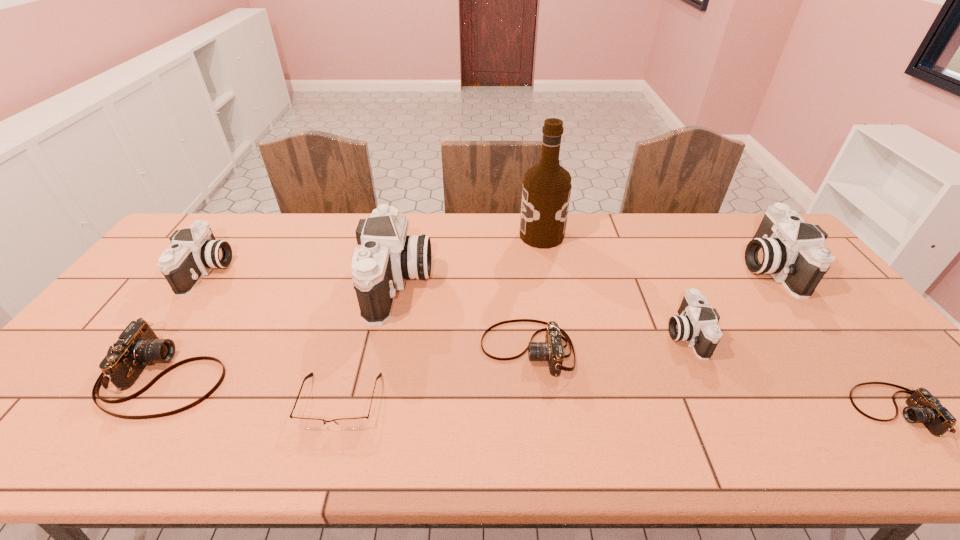
Identify the location of vacant space that's between the third black camera from right to left and the sixth tallest camera. tap(463, 316).

Find the location of `vacant area that lies between the tallest camera and the third tallest camera`. vacant area that lies between the tallest camera and the third tallest camera is located at coordinates (302, 278).

This screenshot has height=540, width=960. In order to click on free space between the sixth shortest camera and the third tallest camera in this screenshot , I will do `click(488, 269)`.

You are a GUI agent. You are given a task and a screenshot of the screen. Output one action in this format:
    pyautogui.click(x=<x>, y=<y>)
    Task: Click on the vacant space that is in between the fourth tallest camera and the spectacles
    This screenshot has height=540, width=960.
    Given the screenshot: What is the action you would take?
    pyautogui.click(x=513, y=367)

This screenshot has height=540, width=960. Identify the location of blank region between the sixth tallest camera and the rightmost black camera. (647, 308).

At what (x,y) coordinates should I click in order to perform the action: click on object that is the second closest to the shortest object. Please return your answer as a coordinate pair (x, y). The image size is (960, 540). Looking at the image, I should click on (138, 346).

Select which object is the sixth closest to the eighth tallest object. Please provide its 2D coordinates. Your answer should be formatted as a tuple, i.e. [(x, y)], where the tuple contains the x and y coordinates of a point satisfying the conditions above.

[(311, 423)]

In order to click on camera that stands as the seventh closest to the spectacles in this screenshot , I will do `click(785, 246)`.

I want to click on camera that stands as the fifth closest to the fifth shortest object, so click(x=138, y=346).

The width and height of the screenshot is (960, 540). Find the location of `the third closest black camera relative to the fifth camera from right to left`. the third closest black camera relative to the fifth camera from right to left is located at coordinates (785, 246).